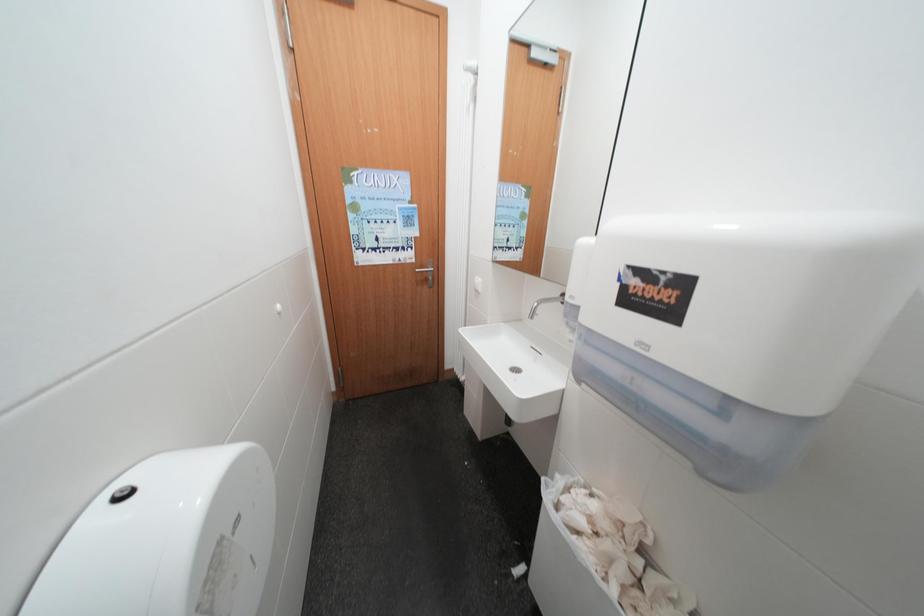
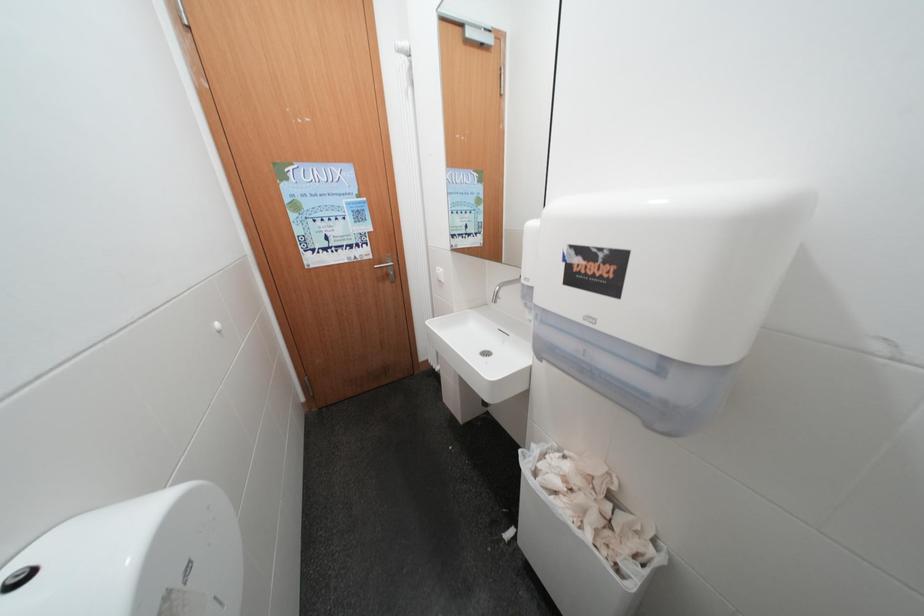
Question: In a continuous first-person perspective shot, in which direction is the camera moving?

Choices:
 (A) Left
 (B) Right
 (C) Forward
 (D) Backward

Answer: (B)